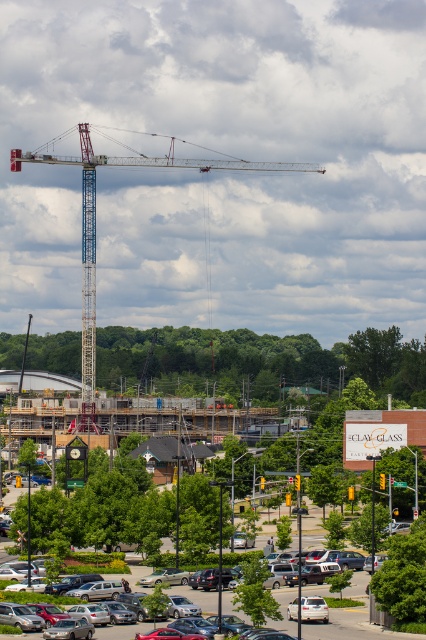
Which of these two, blue metallic crane at upper left or white matte car at center, stands shorter?

Standing shorter between the two is white matte car at center.

Which is in front, point (86, 332) or point (324, 604)?

Point (324, 604) is in front.

What do you see at coordinates (94, 227) in the screenshot? The height and width of the screenshot is (640, 426). I see `blue metallic crane at upper left` at bounding box center [94, 227].

Where is `blue metallic crane at upper left`? The width and height of the screenshot is (426, 640). blue metallic crane at upper left is located at coordinates (94, 227).

Can you confirm if silver metallic sedan at lower center is bigger than white matte car at center?

Indeed, silver metallic sedan at lower center has a larger size compared to white matte car at center.

Who is taller, silver metallic sedan at lower center or white matte car at center?

silver metallic sedan at lower center

At what (x,y) coordinates should I click in order to perform the action: click on silver metallic sedan at lower center. Please return your answer as a coordinate pair (x, y). This screenshot has height=640, width=426. Looking at the image, I should click on (350, 625).

Is point (115, 161) in front of point (356, 618)?

No, (115, 161) is behind (356, 618).

The image size is (426, 640). I want to click on blue metallic crane at upper left, so click(x=94, y=227).